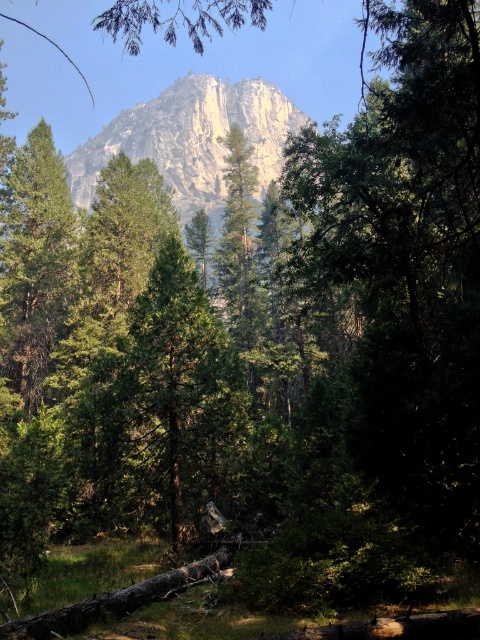
Question: Is smooth rock mountain at upper center to the right of green matte tree at left from the viewer's perspective?

Choices:
 (A) yes
 (B) no

Answer: (B)

Question: Which point is closer to the camera?

Choices:
 (A) (225, 182)
 (B) (36, 262)

Answer: (B)

Question: Is smooth rock mountain at upper center above green matte tree at left?

Choices:
 (A) no
 (B) yes

Answer: (B)

Question: Does smooth rock mountain at upper center have a greater width compared to green matte tree at left?

Choices:
 (A) yes
 (B) no

Answer: (A)

Question: Which object appears closest to the camera in this image?

Choices:
 (A) green matte tree at left
 (B) smooth rock mountain at upper center

Answer: (A)